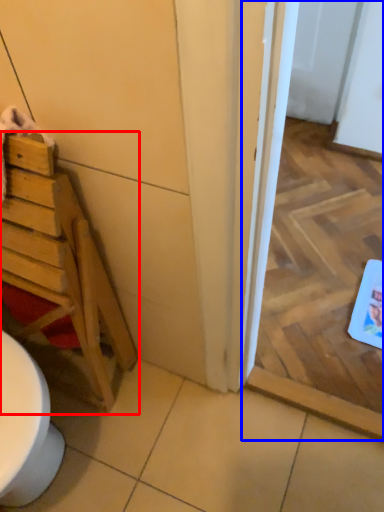
Question: Which object appears farthest to the camera in this image, furniture (highlighted by a red box) or screen door (highlighted by a blue box)?

Choices:
 (A) furniture
 (B) screen door

Answer: (B)